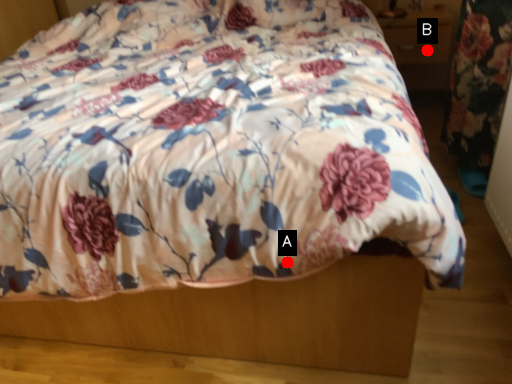
Question: Two points are circled on the image, labeled by A and B beside each circle. Among these points, which one is farthest from the camera?

Choices:
 (A) A is further
 (B) B is further

Answer: (B)